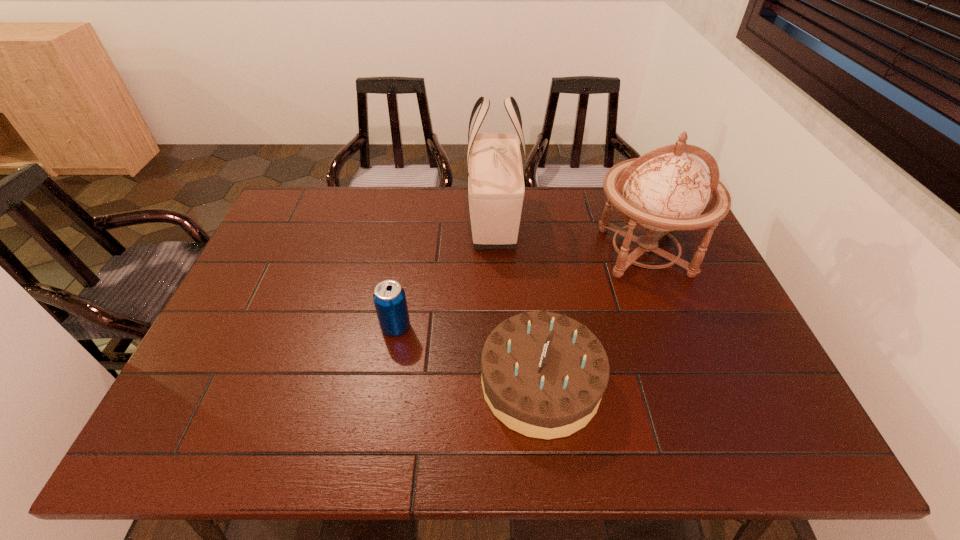
This screenshot has width=960, height=540. I want to click on shopping bag that is at the far edge, so click(496, 188).

At what (x,y) coordinates should I click in order to perform the action: click on globe that is at the far edge. Please return your answer as a coordinate pair (x, y). This screenshot has height=540, width=960. Looking at the image, I should click on coord(666,189).

This screenshot has height=540, width=960. Identify the location of object at the near edge. (543, 374).

Where is `object that is at the right edge`? object that is at the right edge is located at coordinates (666, 189).

Find the location of a particular element. The height and width of the screenshot is (540, 960). object that is at the far right corner is located at coordinates (666, 189).

This screenshot has width=960, height=540. I want to click on vacant region at the far edge of the desktop, so click(531, 205).

The height and width of the screenshot is (540, 960). In the image, there is a desktop. Identify the location of free space at the near edge. (541, 441).

In the image, there is a desktop. Where is `free space at the left edge`? The height and width of the screenshot is (540, 960). free space at the left edge is located at coordinates (238, 310).

Where is `vacant space at the right edge of the desktop`? The image size is (960, 540). vacant space at the right edge of the desktop is located at coordinates (727, 399).

Locate an element on the screen. Image resolution: width=960 pixels, height=540 pixels. free location at the near left corner is located at coordinates (162, 436).